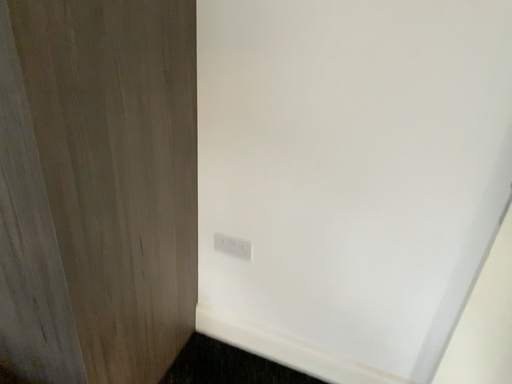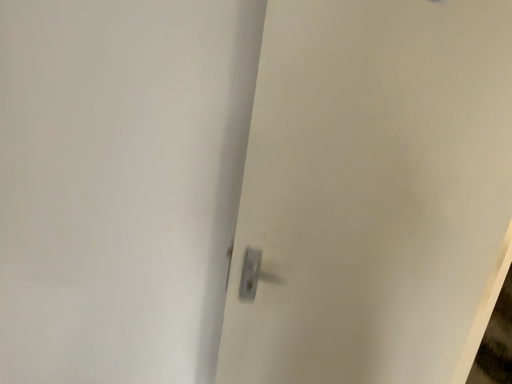
Question: How did the camera likely rotate when shooting the video?

Choices:
 (A) rotated right
 (B) rotated left

Answer: (A)